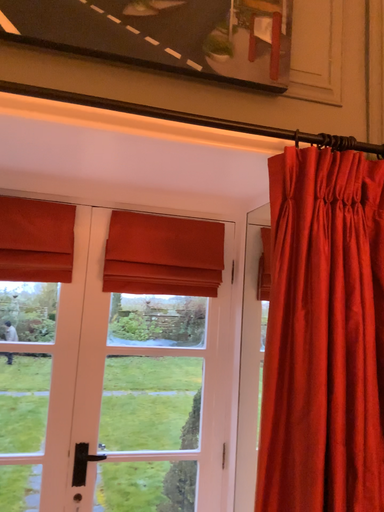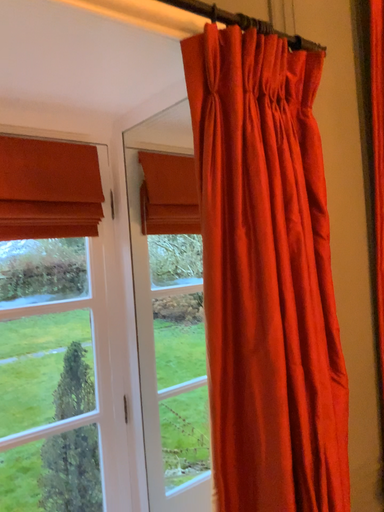
Question: Which way did the camera rotate in the video?

Choices:
 (A) rotated left
 (B) rotated right

Answer: (B)